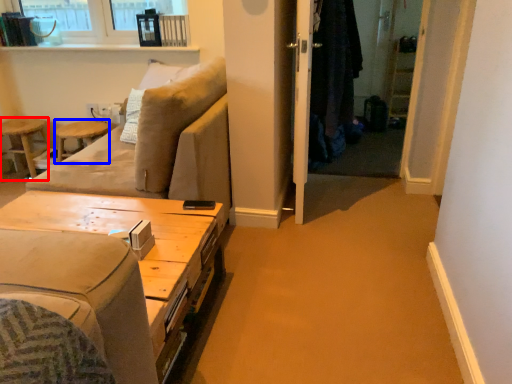
Question: Which of the following is the closest to the observer, bar stool (highlighted by a red box) or bar stool (highlighted by a blue box)?

Choices:
 (A) bar stool
 (B) bar stool

Answer: (B)